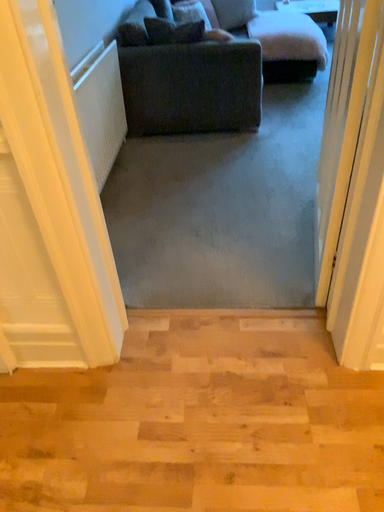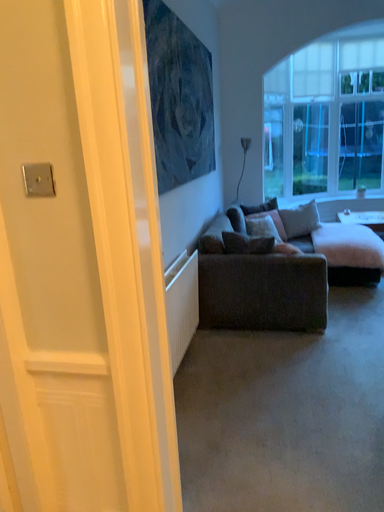
Question: How did the camera likely rotate when shooting the video?

Choices:
 (A) rotated right
 (B) rotated left

Answer: (B)